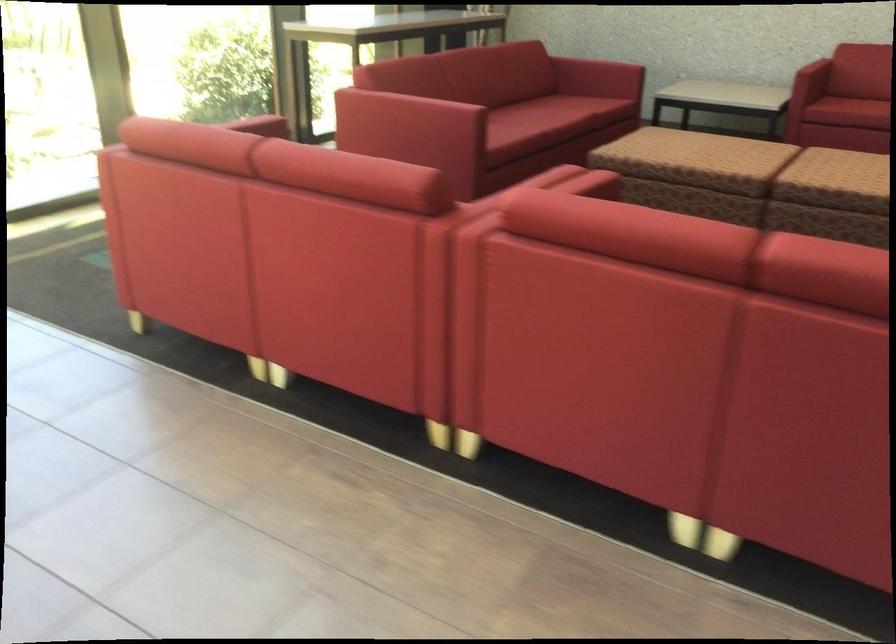
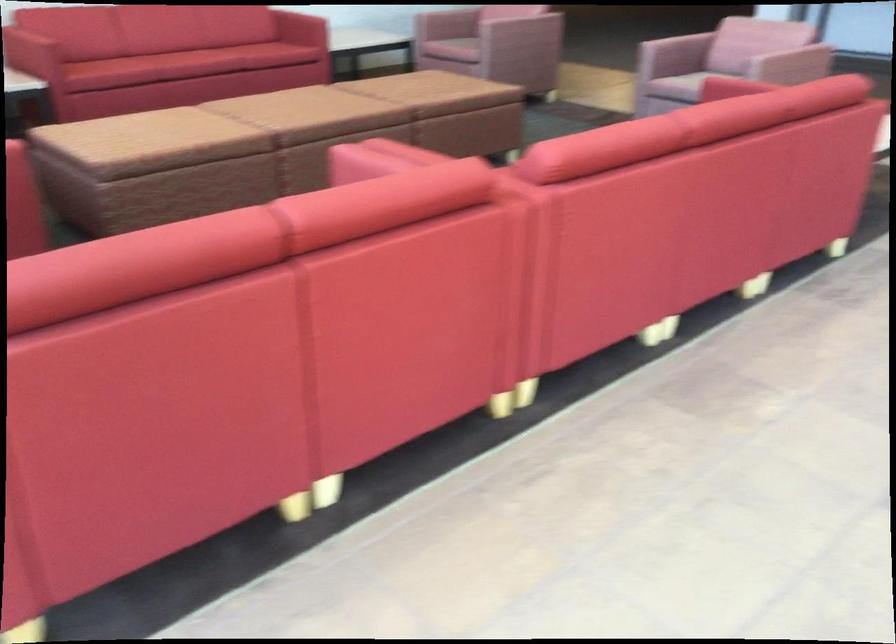
The first image is from the beginning of the video and the second image is from the end. How did the camera likely rotate when shooting the video?

The rotation direction of the camera is right-down.